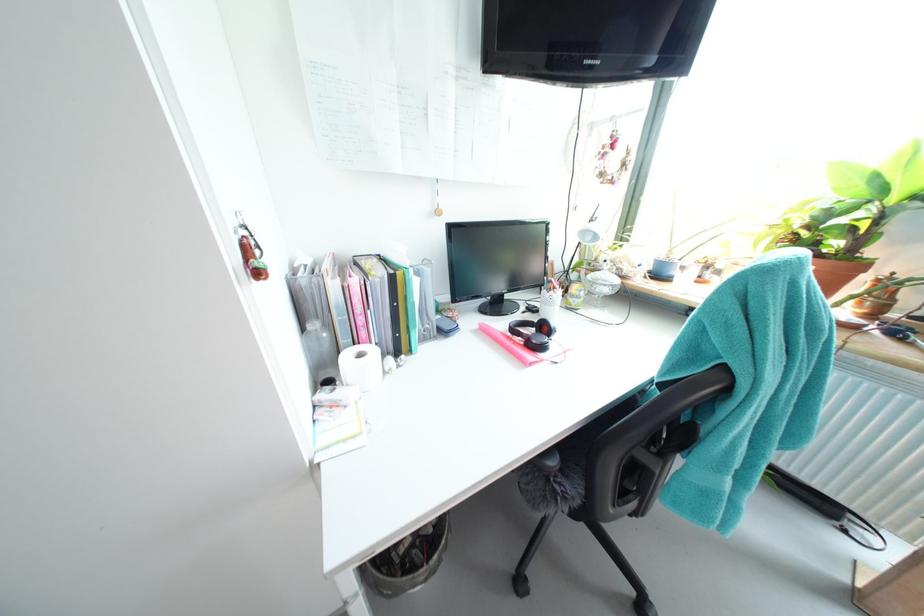
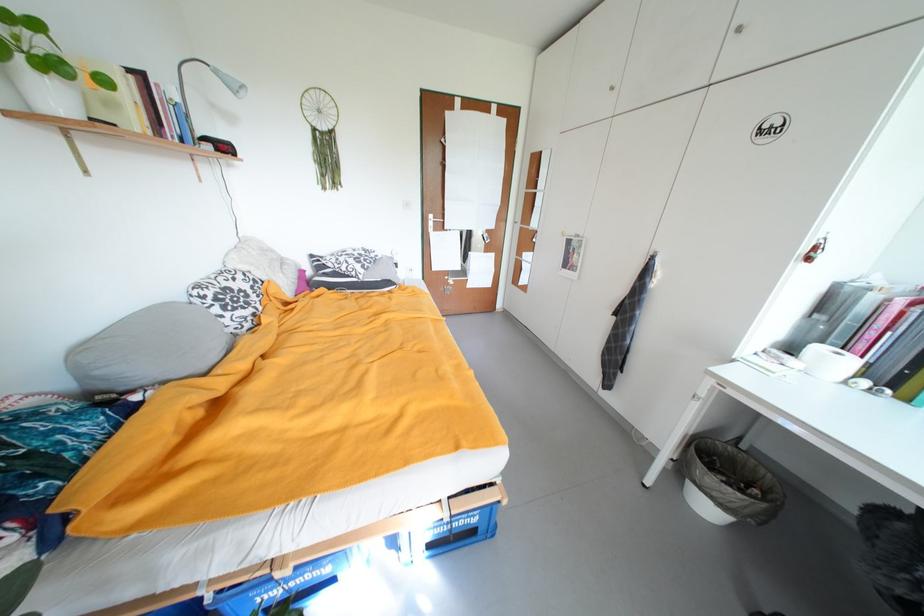
Locate, in the second image, the point that corresponds to pixel 369 357 in the first image.

(845, 355)